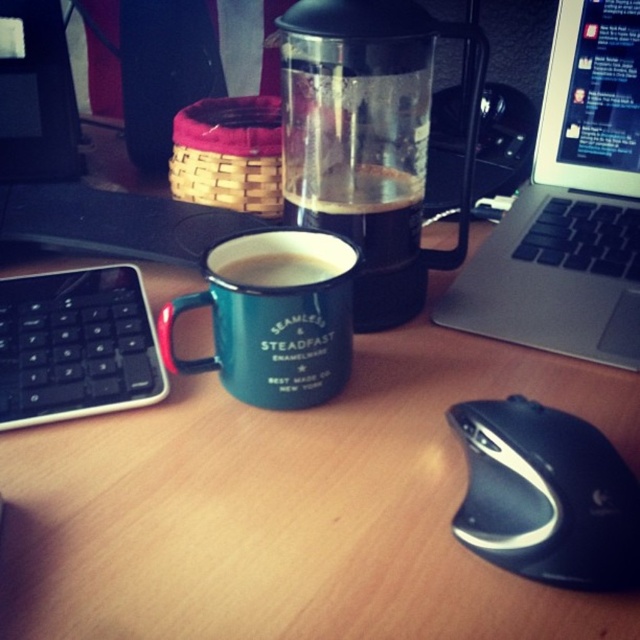
You are organizing your desk and want to place a 1.5 inch wide notebook between the teal enamel mug at center and the matte enamel mug at center. Can you fit it there?

The teal enamel mug at center and the matte enamel mug at center are 1.04 inches apart. Since the notebook is 1.5 inches wide, it cannot fit between them as the space is narrower than the notebook.

You are organizing a small party and need to serve coffee. You have a translucent glass coffee at center and a teal enamel mug at center. If you want to serve more coffee, which container should you choose?

The translucent glass coffee at center is bigger than the teal enamel mug at center, so you should choose the translucent glass coffee at center to serve more coffee.

You are organizing your desk and want to place the teal enamel mug at center and the matte enamel mug at center in a specific order. According to the image, which mug is positioned to the left?

The matte enamel mug at center is positioned to the left of the teal enamel mug at center.